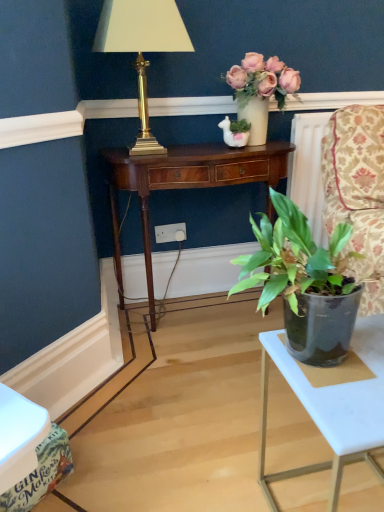
The width and height of the screenshot is (384, 512). I want to click on vacant region below mahogany wood desk at center (from a real-world perspective), so click(201, 307).